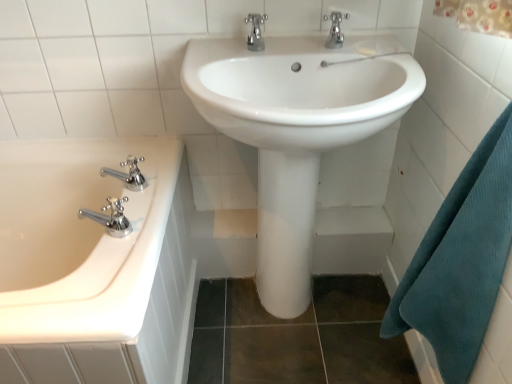
Measure the distance between point (27, 238) and camera.

Point (27, 238) is 4.57 feet away from camera.

I want to click on chrome metallic faucet at left, the 2th tap in the bottom-to-top sequence, so click(x=128, y=174).

This screenshot has height=384, width=512. What do you see at coordinates (461, 260) in the screenshot? I see `teal waffle towel at right` at bounding box center [461, 260].

Image resolution: width=512 pixels, height=384 pixels. What do you see at coordinates (110, 217) in the screenshot?
I see `chrome/metallic faucet at left, placed as the 4th tap when sorted from top to bottom` at bounding box center [110, 217].

Based on the photo, measure the distance between chrome metallic faucet at upper center, the first tap in the top-to-bottom sequence, and camera.

A distance of 3.70 feet exists between chrome metallic faucet at upper center, the first tap in the top-to-bottom sequence, and camera.

Find the location of a particular element. This screenshot has height=384, width=512. white glossy bathtub at left is located at coordinates (79, 238).

Considering the relative positions of white glossy sink at center and teal waffle towel at right in the image provided, is white glossy sink at center in front of teal waffle towel at right?

No, the depth of white glossy sink at center is greater than that of teal waffle towel at right.

Based on their positions, is white glossy sink at center located to the left or right of teal waffle towel at right?

white glossy sink at center is positioned on teal waffle towel at right's left side.

Does point (277, 279) come in front of point (431, 317)?

No, (277, 279) is behind (431, 317).

Is chrome metallic faucet at left, the 2th tap in the bottom-to-top sequence, completely or partially inside chrome metallic faucet at upper center, positioned as the second tap in right-to-left order?

No.

Which is in front, point (249, 22) or point (138, 160)?

The point (249, 22) is more forward.

The width and height of the screenshot is (512, 384). In order to click on the 2nd tap to the left when counting from the chrome metallic faucet at upper center, which appears as the third tap when ordered from the bottom in this screenshot , I will do `click(128, 174)`.

Measure the distance between chrome metallic faucet at upper center, positioned as the second tap in right-to-left order, and chrome metallic faucet at left, the fourth tap from the right.

chrome metallic faucet at upper center, positioned as the second tap in right-to-left order, and chrome metallic faucet at left, the fourth tap from the right, are 18.86 inches apart from each other.

Between chrome metallic faucet at left, which is the third tap from top to bottom, and chrome metallic faucet at upper center, positioned as the second tap in right-to-left order, which one has more height?

Result: chrome metallic faucet at left, which is the third tap from top to bottom, is taller.

Considering the positions of objects chrome metallic faucet at left, arranged as the first tap when viewed from the left, and chrome metallic faucet at upper center, acting as the third tap starting from the left, in the image provided, who is more to the left, chrome metallic faucet at left, arranged as the first tap when viewed from the left, or chrome metallic faucet at upper center, acting as the third tap starting from the left,?

chrome metallic faucet at left, arranged as the first tap when viewed from the left, is more to the left.

The width and height of the screenshot is (512, 384). Identify the location of tap that is the 1st one when counting downward from the chrome metallic faucet at upper center, arranged as the 2th tap when viewed from the top (from the image's perspective). (128, 174).

Considering the positions of objects chrome metallic faucet at left, which is the third tap from top to bottom, and chrome metallic faucet at upper center, positioned as the second tap in right-to-left order, in the image provided, who is in front, chrome metallic faucet at left, which is the third tap from top to bottom, or chrome metallic faucet at upper center, positioned as the second tap in right-to-left order,?

chrome metallic faucet at upper center, positioned as the second tap in right-to-left order, is in front.

Are white glossy bathtub at left and chrome metallic faucet at upper center, arranged as the 2th tap when viewed from the top, beside each other?

No, white glossy bathtub at left is not touching chrome metallic faucet at upper center, arranged as the 2th tap when viewed from the top.

Would you say white glossy bathtub at left is outside chrome metallic faucet at upper center, acting as the third tap starting from the left?

That's correct, white glossy bathtub at left is outside of chrome metallic faucet at upper center, acting as the third tap starting from the left.

Which is more to the left, white glossy bathtub at left or chrome metallic faucet at upper center, positioned as the second tap in right-to-left order?

white glossy bathtub at left.

Is white glossy bathtub at left further to the viewer compared to chrome metallic faucet at upper center, positioned as the second tap in right-to-left order?

No, white glossy bathtub at left is closer to the camera.

Between chrome/metallic faucet at left, the 1th tap from the bottom, and white glossy bathtub at left, which one appears on the left side from the viewer's perspective?

white glossy bathtub at left.

From a real-world perspective, is chrome/metallic faucet at left, which ranks as the 3th tap in right-to-left order, on top of white glossy bathtub at left?

Correct, in the physical world, chrome/metallic faucet at left, which ranks as the 3th tap in right-to-left order, is higher than white glossy bathtub at left.

Is chrome/metallic faucet at left, placed as the 4th tap when sorted from top to bottom, looking in the opposite direction of white glossy bathtub at left?

That's not correct — chrome/metallic faucet at left, placed as the 4th tap when sorted from top to bottom, is not looking away from white glossy bathtub at left.

Is chrome/metallic faucet at left, placed as the 4th tap when sorted from top to bottom, wider or thinner than white glossy bathtub at left?

Considering their sizes, chrome/metallic faucet at left, placed as the 4th tap when sorted from top to bottom, looks slimmer than white glossy bathtub at left.

Is white glossy sink at center touching chrome metallic faucet at left, the fourth tap from the right?

No, white glossy sink at center is not beside chrome metallic faucet at left, the fourth tap from the right.

From their relative heights in the image, would you say white glossy sink at center is taller or shorter than chrome metallic faucet at left, the 2th tap in the bottom-to-top sequence?

Clearly, white glossy sink at center is taller compared to chrome metallic faucet at left, the 2th tap in the bottom-to-top sequence.

Considering their positions, is white glossy sink at center located in front of or behind chrome metallic faucet at left, the fourth tap from the right?

In the image, white glossy sink at center appears in front of chrome metallic faucet at left, the fourth tap from the right.

From the image's perspective, who appears lower, white glossy sink at center or chrome metallic faucet at left, the fourth tap from the right?

white glossy sink at center appears lower in the image.

Between white glossy sink at center and white glossy bathtub at left, which one appears on the right side from the viewer's perspective?

From the viewer's perspective, white glossy sink at center appears more on the right side.

Which of these two, white glossy sink at center or white glossy bathtub at left, is smaller?

white glossy sink at center is smaller.

Between white glossy sink at center and white glossy bathtub at left, which one has larger width?

white glossy bathtub at left is wider.

Based on the photo, from a real-world perspective, which is physically below, white glossy sink at center or white glossy bathtub at left?

From a 3D spatial view, white glossy bathtub at left is below.

Image resolution: width=512 pixels, height=384 pixels. What are the coordinates of `bath towel above the white glossy sink at center (from a real-world perspective)` in the screenshot? It's located at (461, 260).

From the image's perspective, which tap is the 1st one below the chrome metallic faucet at upper center, which appears as the third tap when ordered from the bottom? Please provide its 2D coordinates.

[(128, 174)]

From the image, which object appears to be nearer to chrome/metallic faucet at left, placed as the 4th tap when sorted from top to bottom, teal waffle towel at right or white glossy sink at center?

Based on the image, white glossy sink at center appears to be nearer to chrome/metallic faucet at left, placed as the 4th tap when sorted from top to bottom.

When comparing their distances from chrome metallic faucet at left, arranged as the first tap when viewed from the left, does chrome/metallic faucet at left, acting as the 2th tap starting from the left, or white glossy bathtub at left seem closer?

Among the two, chrome/metallic faucet at left, acting as the 2th tap starting from the left, is located nearer to chrome metallic faucet at left, arranged as the first tap when viewed from the left.

Based on their spatial positions, is teal waffle towel at right or chrome metallic faucet at upper center, positioned as the second tap in right-to-left order, further from chrome/metallic faucet at left, acting as the 2th tap starting from the left?

teal waffle towel at right is positioned further to the anchor chrome/metallic faucet at left, acting as the 2th tap starting from the left.

Consider the image. From the image, which object appears to be nearer to chrome metallic faucet at upper center, which appears as the third tap when ordered from the bottom, chrome metallic faucet at upper center, the first tap in the top-to-bottom sequence, or chrome/metallic faucet at left, placed as the 4th tap when sorted from top to bottom?

Based on the image, chrome metallic faucet at upper center, the first tap in the top-to-bottom sequence, appears to be nearer to chrome metallic faucet at upper center, which appears as the third tap when ordered from the bottom.

Estimate the real-world distances between objects in this image. Which object is further from white glossy sink at center, chrome metallic faucet at upper center, arranged as the 2th tap when viewed from the top, or white glossy bathtub at left?

The object further to white glossy sink at center is white glossy bathtub at left.

Looking at this image, based on their spatial positions, is chrome/metallic faucet at left, the 1th tap from the bottom, or chrome metallic faucet at upper center, acting as the third tap starting from the left, further from chrome metallic faucet at upper center, which appears as the 4th tap when viewed from the left?

The object further to chrome metallic faucet at upper center, which appears as the 4th tap when viewed from the left, is chrome/metallic faucet at left, the 1th tap from the bottom.

From the image, which object appears to be nearer to chrome metallic faucet at upper center, acting as the third tap starting from the left, chrome metallic faucet at left, arranged as the first tap when viewed from the left, or white glossy bathtub at left?

chrome metallic faucet at left, arranged as the first tap when viewed from the left, lies closer to chrome metallic faucet at upper center, acting as the third tap starting from the left, than the other object.

Considering their positions, is white glossy sink at center positioned closer to chrome/metallic faucet at left, acting as the 2th tap starting from the left, than chrome metallic faucet at upper center, arranged as the 2th tap when viewed from the top?

white glossy sink at center lies closer to chrome/metallic faucet at left, acting as the 2th tap starting from the left, than the other object.

Where is `sink between chrome/metallic faucet at left, which ranks as the 3th tap in right-to-left order, and chrome metallic faucet at upper center, which is counted as the fourth tap, starting from the bottom, from left to right`? sink between chrome/metallic faucet at left, which ranks as the 3th tap in right-to-left order, and chrome metallic faucet at upper center, which is counted as the fourth tap, starting from the bottom, from left to right is located at coordinates (296, 130).

At what (x,y) coordinates should I click in order to perform the action: click on tap between chrome metallic faucet at upper center, arranged as the 2th tap when viewed from the top, and chrome/metallic faucet at left, acting as the 2th tap starting from the left, in the vertical direction. Please return your answer as a coordinate pair (x, y). This screenshot has height=384, width=512. Looking at the image, I should click on (128, 174).

Locate an element on the screen. The image size is (512, 384). sink between chrome metallic faucet at upper center, which appears as the 4th tap when viewed from the left, and teal waffle towel at right in the up-down direction is located at coordinates (296, 130).

You are a GUI agent. You are given a task and a screenshot of the screen. Output one action in this format:
    pyautogui.click(x=<x>, y=<y>)
    Task: Click on the tap located between chrome/metallic faucet at left, which ranks as the 3th tap in right-to-left order, and chrome metallic faucet at upper center, which appears as the 4th tap when viewed from the left, in the left-right direction
    
    Given the screenshot: What is the action you would take?
    pyautogui.click(x=255, y=32)